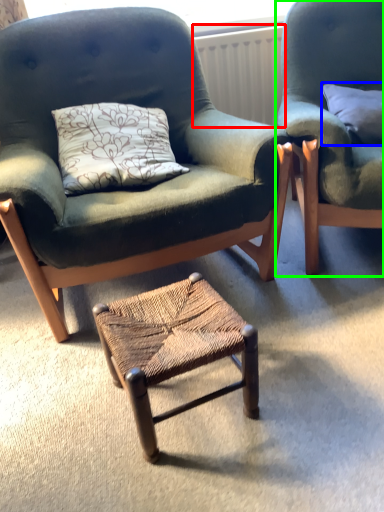
Question: Estimate the real-world distances between objects in this image. Which object is closer to radiator (highlighted by a red box), pillow (highlighted by a blue box) or chair (highlighted by a green box)?

Choices:
 (A) pillow
 (B) chair

Answer: (A)